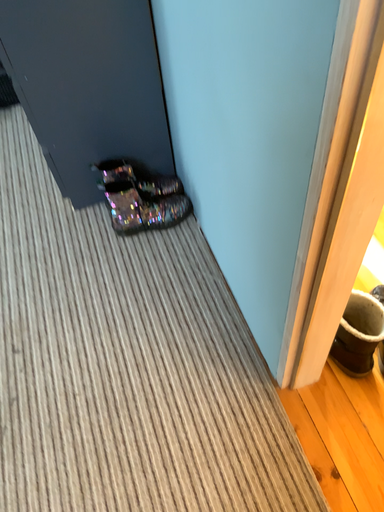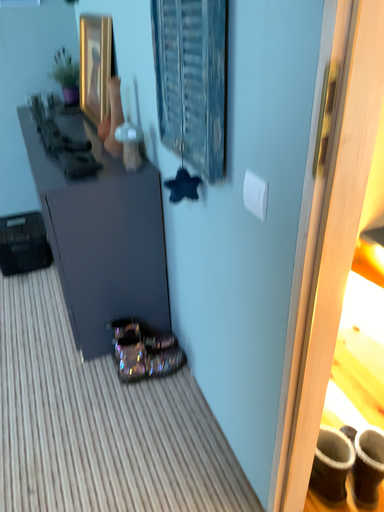
Question: Which way did the camera rotate in the video?

Choices:
 (A) rotated upward
 (B) rotated downward

Answer: (A)